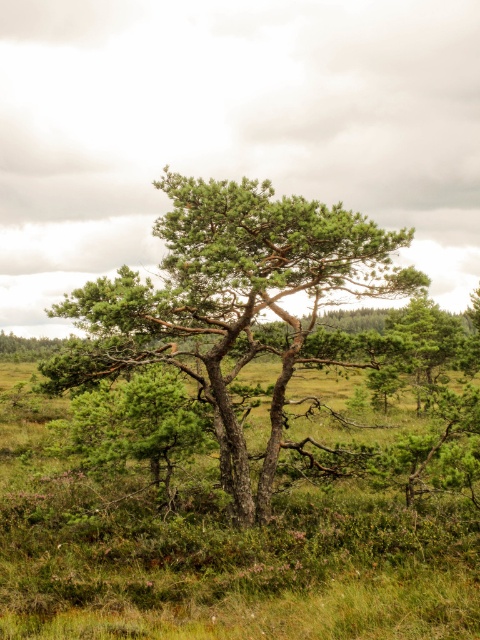
Question: Does green textured tree at center appear on the right side of green matte tree at center?

Choices:
 (A) no
 (B) yes

Answer: (A)

Question: Which point is farther from the camera taking this photo?

Choices:
 (A) (367, 266)
 (B) (416, 304)

Answer: (B)

Question: Does green textured tree at center appear under green matte tree at center?

Choices:
 (A) yes
 (B) no

Answer: (B)

Question: Can you confirm if green textured tree at center is smaller than green matte tree at center?

Choices:
 (A) yes
 (B) no

Answer: (B)

Question: Which point is farther to the camera?

Choices:
 (A) (320, 296)
 (B) (405, 321)

Answer: (B)